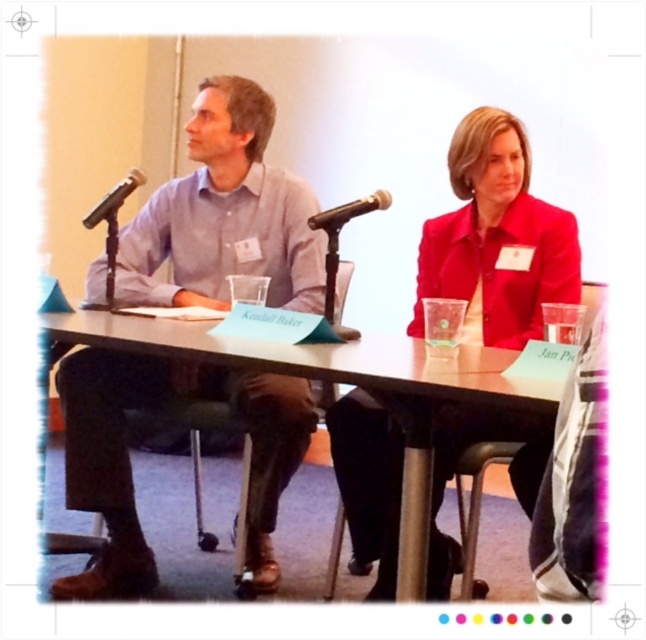
Question: Is matte light blue shirt at center positioned at the back of matte red blazer at center?

Choices:
 (A) yes
 (B) no

Answer: (A)

Question: Among these points, which one is farthest from the camera?

Choices:
 (A) (162, 342)
 (B) (484, 147)
 (C) (123, 182)

Answer: (C)

Question: Does brown wood table at center have a greater width compared to black plastic microphone at center?

Choices:
 (A) no
 (B) yes

Answer: (B)

Question: Which of these objects is positioned closest to the matte light blue shirt at center?

Choices:
 (A) black matte microphone at left
 (B) brown wood table at center

Answer: (B)

Question: Does matte red blazer at center appear on the right side of brown wood table at center?

Choices:
 (A) no
 (B) yes

Answer: (B)

Question: Which point appears closest to the camera in this image?

Choices:
 (A) (105, 204)
 (B) (174, 378)
 (C) (337, 212)

Answer: (C)